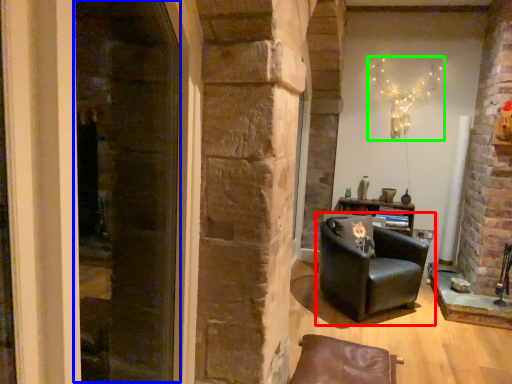
Question: Based on their relative distances, which object is nearer to chair (highlighted by a red box)? Choose from screen door (highlighted by a blue box) and christmas light (highlighted by a green box).

Choices:
 (A) screen door
 (B) christmas light

Answer: (B)